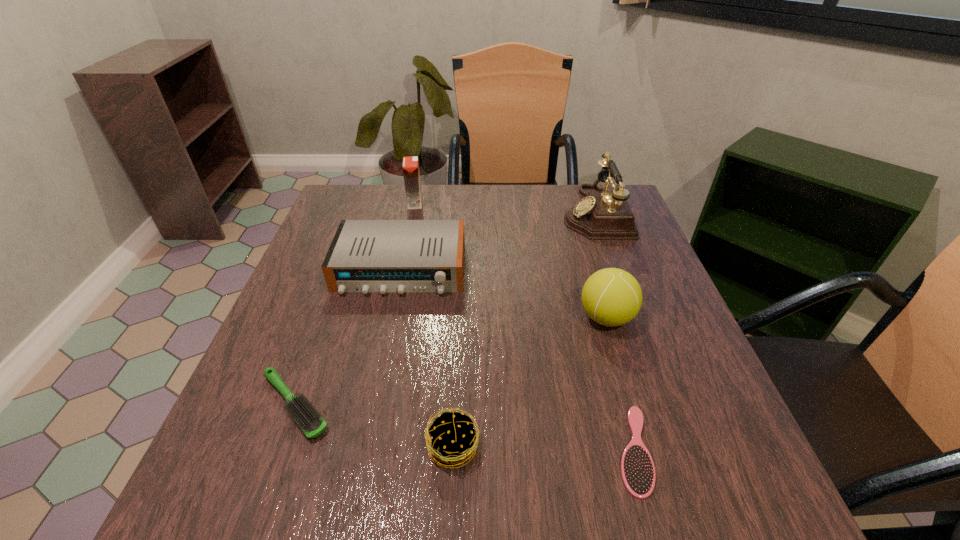
You are a GUI agent. You are given a task and a screenshot of the screen. Output one action in this format:
    pyautogui.click(x=<x>, y=<y>)
    Task: Click on the telephone
    This screenshot has height=540, width=960.
    Given the screenshot: What is the action you would take?
    tap(601, 215)

Where is `orange juice`? Image resolution: width=960 pixels, height=540 pixels. orange juice is located at coordinates (411, 174).

This screenshot has height=540, width=960. Identify the location of tennis ball. (612, 297).

Where is `the fifth nearest object`? The image size is (960, 540). the fifth nearest object is located at coordinates (365, 256).

Locate an element on the screen. patty is located at coordinates (459, 443).

Where is `the taller hairbrush`? This screenshot has width=960, height=540. the taller hairbrush is located at coordinates (307, 417).

At what (x,y) coordinates should I click in order to perform the action: click on the second shortest object. Please return your answer as a coordinate pair (x, y). The height and width of the screenshot is (540, 960). Looking at the image, I should click on (307, 417).

Locate an element on the screen. The width and height of the screenshot is (960, 540). the shorter hairbrush is located at coordinates (638, 473).

In order to click on the right hairbrush in this screenshot , I will do `click(638, 473)`.

This screenshot has height=540, width=960. I want to click on vacant space located on the dial of the telephone, so (x=432, y=212).